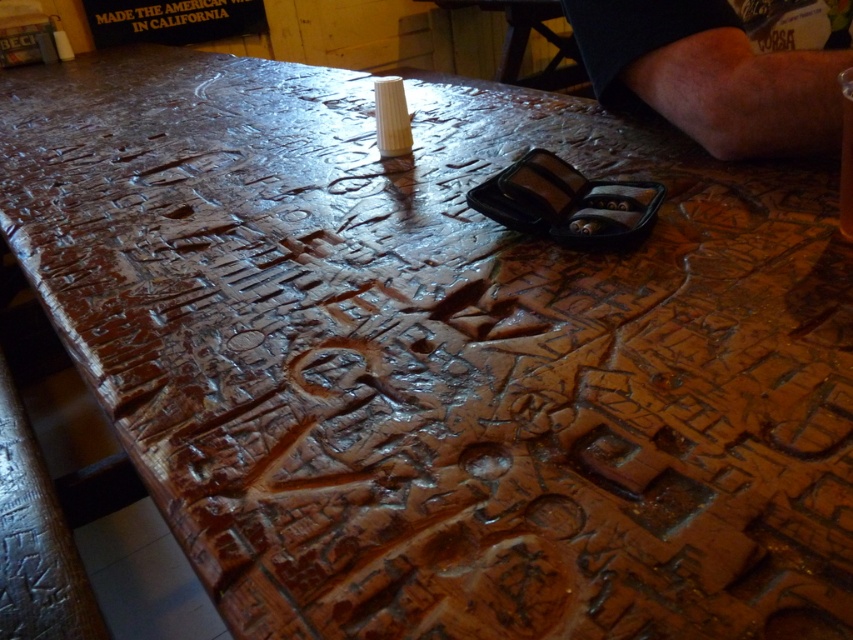
Is black plastic text at upper center bigger than translucent glass beer at upper center?

Answer: Yes, black plastic text at upper center is bigger than translucent glass beer at upper center.

Who is shorter, black plastic text at upper center or translucent glass beer at upper center?

translucent glass beer at upper center

At what (x,y) coordinates should I click in order to perform the action: click on black plastic text at upper center. Please return your answer as a coordinate pair (x, y). The width and height of the screenshot is (853, 640). Looking at the image, I should click on [175, 17].

Is dark skin at upper right to the left of translucent glass beer at upper center from the viewer's perspective?

In fact, dark skin at upper right is to the right of translucent glass beer at upper center.

Is dark skin at upper right positioned in front of translucent glass beer at upper center?

No, dark skin at upper right is further to the viewer.

The image size is (853, 640). Describe the element at coordinates (711, 76) in the screenshot. I see `dark skin at upper right` at that location.

You are a GUI agent. You are given a task and a screenshot of the screen. Output one action in this format:
    pyautogui.click(x=<x>, y=<y>)
    Task: Click on the dark skin at upper right
    Image resolution: width=853 pixels, height=640 pixels.
    Given the screenshot: What is the action you would take?
    pyautogui.click(x=711, y=76)

Who is taller, dark skin at upper right or black plastic text at upper center?

With more height is black plastic text at upper center.

Is dark skin at upper right further to the viewer compared to black plastic text at upper center?

No, dark skin at upper right is in front of black plastic text at upper center.

Which is in front, point (809, 122) or point (260, 29)?

Positioned in front is point (809, 122).

I want to click on dark skin at upper right, so click(711, 76).